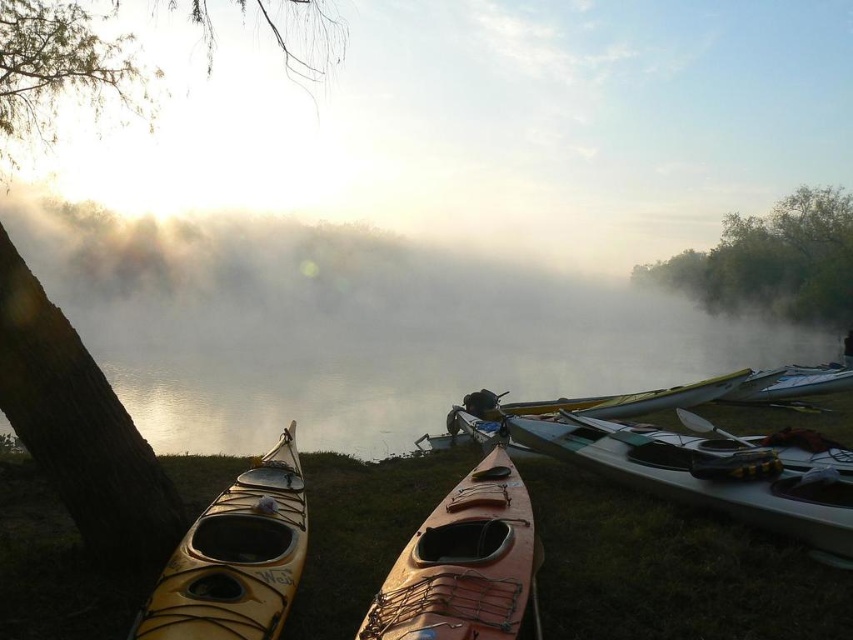
Between green leafy tree at upper left and green matte tree at upper right, which one is positioned higher?

green leafy tree at upper left

Does green leafy tree at upper left have a lesser height compared to green matte tree at upper right?

No, green leafy tree at upper left is not shorter than green matte tree at upper right.

Does point (22, 138) come farther from viewer compared to point (817, 300)?

No, it is in front of (817, 300).

Locate an element on the screen. This screenshot has height=640, width=853. green leafy tree at upper left is located at coordinates click(64, 70).

Who is taller, matte yellow kayak at lower left or green matte tree at upper right?

With more height is green matte tree at upper right.

Between point (202, 577) and point (695, 262), which one is positioned behind?

Point (695, 262)

What do you see at coordinates (236, 557) in the screenshot?
I see `matte yellow kayak at lower left` at bounding box center [236, 557].

This screenshot has width=853, height=640. Find the location of `matte yellow kayak at lower left`. matte yellow kayak at lower left is located at coordinates (236, 557).

Consider the image. Is matte white kayak at center thinner than matte orange kayak at center?

No, matte white kayak at center is not thinner than matte orange kayak at center.

Is matte white kayak at center positioned before matte orange kayak at center?

No, matte white kayak at center is further to the viewer.

This screenshot has width=853, height=640. Describe the element at coordinates (711, 476) in the screenshot. I see `matte white kayak at center` at that location.

Find the location of a particular element. This screenshot has height=640, width=853. matte white kayak at center is located at coordinates (711, 476).